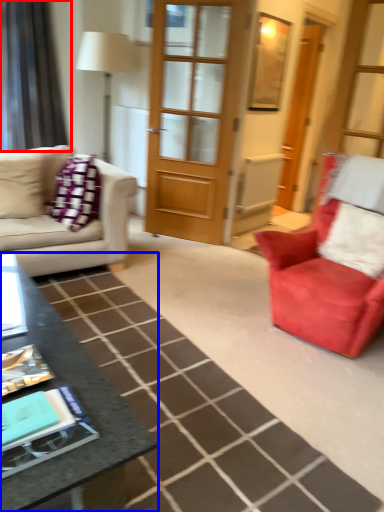
Question: Which of the following is the farthest to the observer, curtain (highlighted by a red box) or table (highlighted by a blue box)?

Choices:
 (A) curtain
 (B) table

Answer: (A)